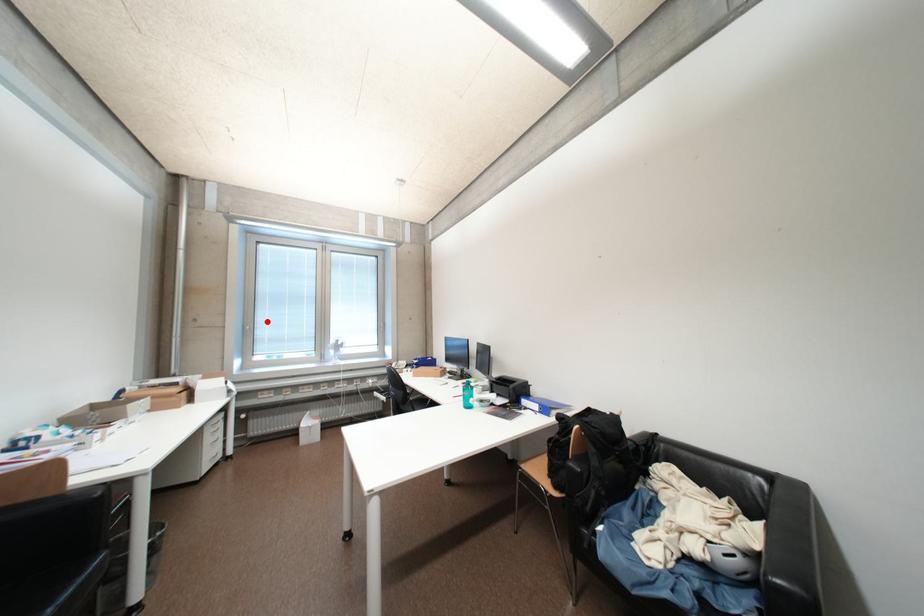
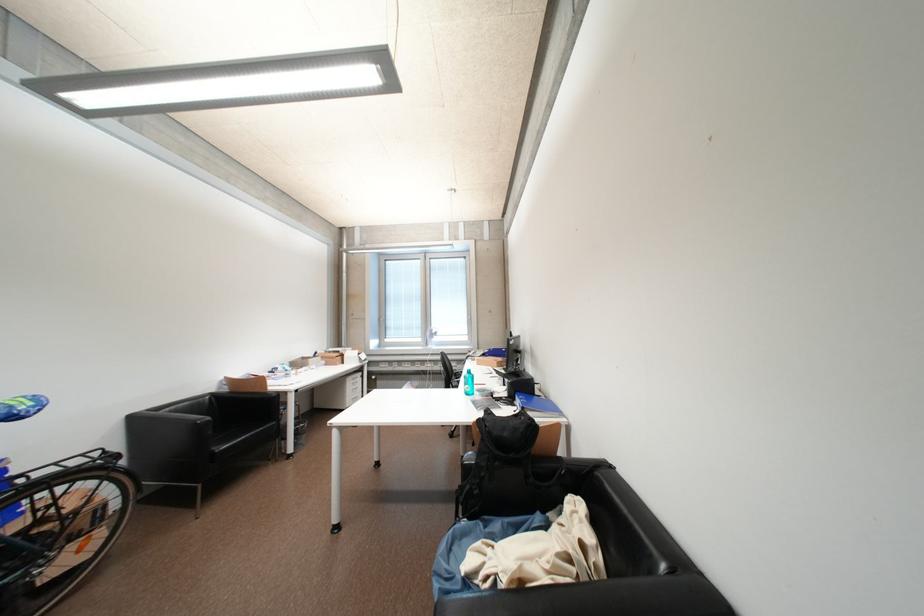
Locate, in the second image, the point that corresponds to the highlighted location in the first image.

(395, 315)